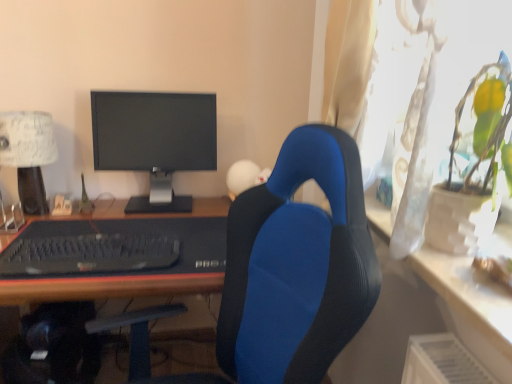
What is the approximate width of black rubberized desk at center?

The width of black rubberized desk at center is 27.48 inches.

The image size is (512, 384). Describe the element at coordinates (87, 253) in the screenshot. I see `black matte keyboard at lower left` at that location.

The height and width of the screenshot is (384, 512). What do you see at coordinates (297, 266) in the screenshot?
I see `blue fabric chair at center` at bounding box center [297, 266].

Where is `matte black monitor at center`? The height and width of the screenshot is (384, 512). matte black monitor at center is located at coordinates (155, 141).

Is matte black monitor at center taller or shorter than white textured lampshade at left?

matte black monitor at center is taller than white textured lampshade at left.

From the image's perspective, who appears lower, matte black monitor at center or white textured lampshade at left?

white textured lampshade at left is shown below in the image.

Consider the image. How far apart are matte black monitor at center and white textured lampshade at left?

matte black monitor at center and white textured lampshade at left are 12.85 inches apart.

Looking at their sizes, would you say matte black monitor at center is wider or thinner than white textured lampshade at left?

matte black monitor at center is thinner than white textured lampshade at left.

From a real-world perspective, is blue fabric chair at center located beneath black rubberized desk at center?

No, from a real-world perspective, blue fabric chair at center is not below black rubberized desk at center.

Is blue fabric chair at center turned away from black rubberized desk at center?

blue fabric chair at center does not have its back to black rubberized desk at center.

Is blue fabric chair at center touching black rubberized desk at center?

blue fabric chair at center is not next to black rubberized desk at center, and they're not touching.

Between blue fabric chair at center and black rubberized desk at center, which one has smaller size?

Smaller between the two is blue fabric chair at center.

Which object is positioned more to the right, white textured lampshade at left or black matte keyboard at lower left?

Positioned to the right is black matte keyboard at lower left.

From the image's perspective, is white textured lampshade at left under black matte keyboard at lower left?

No, from the image's perspective, white textured lampshade at left is not beneath black matte keyboard at lower left.

Is white textured lampshade at left facing away from black matte keyboard at lower left?

No.

Can we say white textured lampshade at left lies outside black matte keyboard at lower left?

Yes, white textured lampshade at left is not within black matte keyboard at lower left.

Would you say matte black monitor at center is part of black rubberized desk at center's contents?

No.

Is black rubberized desk at center not near matte black monitor at center?

Actually, black rubberized desk at center and matte black monitor at center are a little close together.

Considering the relative sizes of black rubberized desk at center and matte black monitor at center in the image provided, is black rubberized desk at center bigger than matte black monitor at center?

Yes.

Between point (114, 234) and point (145, 148), which one is positioned behind?

The point (145, 148) is farther.

Based on their positions, is black matte keyboard at lower left located to the left or right of matte black monitor at center?

In the image, black matte keyboard at lower left appears on the left side of matte black monitor at center.

Looking at this image, is black matte keyboard at lower left oriented towards matte black monitor at center?

No, black matte keyboard at lower left does not turn towards matte black monitor at center.

From a real-world perspective, is black rubberized desk at center positioned above or below black matte keyboard at lower left?

In terms of real-world spatial position, black rubberized desk at center is below black matte keyboard at lower left.

Which is behind, black rubberized desk at center or black matte keyboard at lower left?

black matte keyboard at lower left is further from the camera.

You are a GUI agent. You are given a task and a screenshot of the screen. Output one action in this format:
    pyautogui.click(x=<x>, y=<y>)
    Task: Click on the desk below the black matte keyboard at lower left (from the image's perspective)
    The image size is (512, 384).
    Given the screenshot: What is the action you would take?
    coord(106,287)

Can you confirm if black rubberized desk at center is taller than black matte keyboard at lower left?

Yes.

Considering the relative sizes of black rubberized desk at center and white textured lampshade at left in the image provided, is black rubberized desk at center thinner than white textured lampshade at left?

In fact, black rubberized desk at center might be wider than white textured lampshade at left.

Is black rubberized desk at center closer to the viewer compared to white textured lampshade at left?

Yes, black rubberized desk at center is closer to the camera.

Where is `computer monitor above the white textured lampshade at left (from a real-world perspective)`? The image size is (512, 384). computer monitor above the white textured lampshade at left (from a real-world perspective) is located at coordinates (155, 141).

Image resolution: width=512 pixels, height=384 pixels. Identify the location of desk located on the left of blue fabric chair at center. (106, 287).

Estimate the real-world distances between objects in this image. Which object is closer to black rubberized desk at center, blue fabric chair at center or white textured lampshade at left?

white textured lampshade at left is positioned closer to the anchor black rubberized desk at center.

When comparing their distances from blue fabric chair at center, does white textured lampshade at left or matte black monitor at center seem closer?

matte black monitor at center lies closer to blue fabric chair at center than the other object.

From the image, which object appears to be nearer to blue fabric chair at center, white textured lampshade at left or black matte keyboard at lower left?

black matte keyboard at lower left is positioned closer to the anchor blue fabric chair at center.

When comparing their distances from black matte keyboard at lower left, does white textured lampshade at left or black rubberized desk at center seem further?

white textured lampshade at left lies further to black matte keyboard at lower left than the other object.

Based on their spatial positions, is blue fabric chair at center or black matte keyboard at lower left further from black rubberized desk at center?

Among the two, blue fabric chair at center is located further to black rubberized desk at center.

Considering their positions, is white textured lampshade at left positioned further to black rubberized desk at center than matte black monitor at center?

white textured lampshade at left lies further to black rubberized desk at center than the other object.

From the image, which object appears to be farther from matte black monitor at center, black matte keyboard at lower left or black rubberized desk at center?

The object further to matte black monitor at center is black matte keyboard at lower left.

Which object lies further to the anchor point black matte keyboard at lower left, white textured lampshade at left or blue fabric chair at center?

Result: white textured lampshade at left is further to black matte keyboard at lower left.

The image size is (512, 384). I want to click on desk positioned between blue fabric chair at center and black matte keyboard at lower left from near to far, so click(x=106, y=287).

Find the location of a particular element. Image resolution: width=512 pixels, height=384 pixels. table lamp between matte black monitor at center and black rubberized desk at center in the up-down direction is located at coordinates (28, 154).

Find the location of a particular element. Image resolution: width=512 pixels, height=384 pixels. table lamp between blue fabric chair at center and matte black monitor at center along the z-axis is located at coordinates (28, 154).

I want to click on laptop keyboard between white textured lampshade at left and matte black monitor at center in the horizontal direction, so click(87, 253).